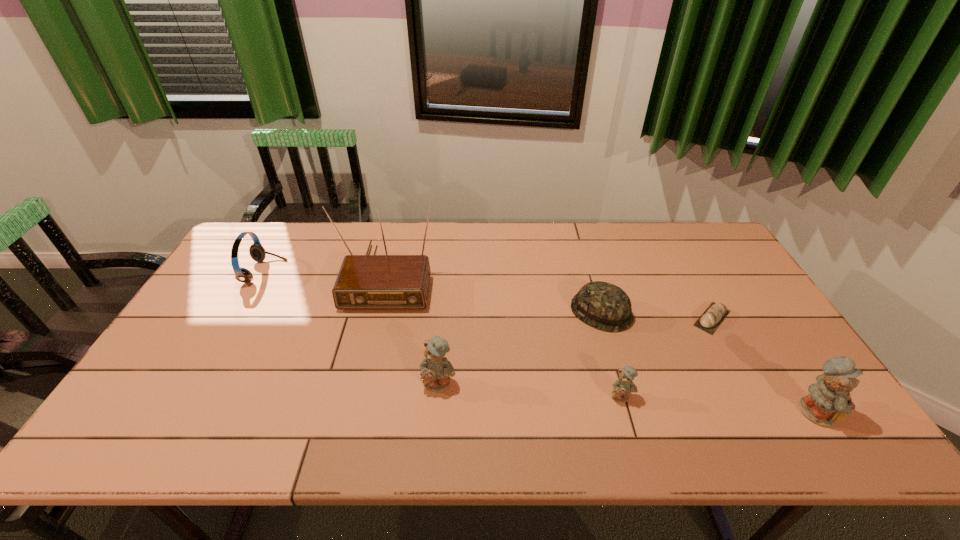
The image size is (960, 540). Find the location of `free spot located 0.180m on the front panel of the radio_receiver`. free spot located 0.180m on the front panel of the radio_receiver is located at coordinates (367, 362).

At what (x,y) coordinates should I click in order to perform the action: click on blank area located on the right of the sixth object from left to right. Please return your answer as a coordinate pair (x, y). This screenshot has height=540, width=960. Looking at the image, I should click on (756, 318).

Where is `headset located in the far edge section of the desktop`? The image size is (960, 540). headset located in the far edge section of the desktop is located at coordinates (257, 252).

Locate an element on the screen. The image size is (960, 540). radio_receiver situated at the far edge is located at coordinates (365, 282).

Where is `object at the left edge`? object at the left edge is located at coordinates (257, 252).

Identify the location of teddy bear at the right edge. (829, 401).

This screenshot has width=960, height=540. I want to click on pita bread present at the right edge, so click(714, 315).

The image size is (960, 540). I want to click on object that is at the far left corner, so click(x=257, y=252).

Identify the location of object positioned at the near right corner. The width and height of the screenshot is (960, 540). (829, 401).

Image resolution: width=960 pixels, height=540 pixels. What are the coordinates of `vacant space at the far edge` in the screenshot? It's located at (x=503, y=223).